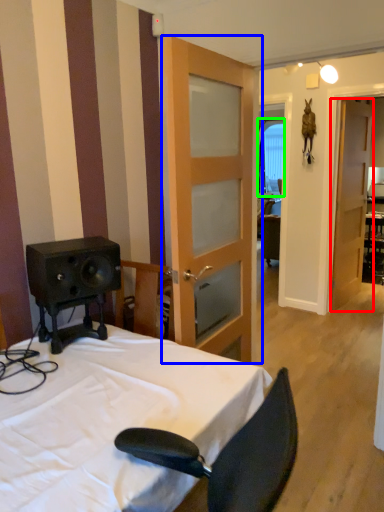
Question: Based on their relative distances, which object is nearer to door (highlighted by a red box)? Choose from door (highlighted by a blue box) and window (highlighted by a green box).

Choices:
 (A) door
 (B) window

Answer: (B)